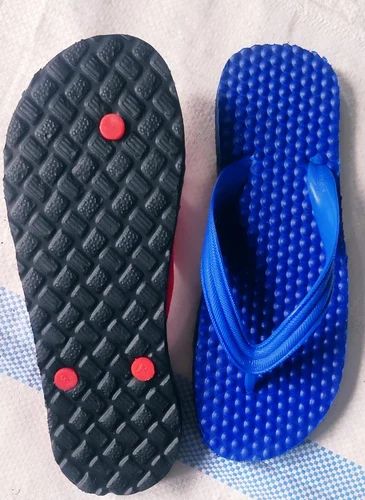
Image resolution: width=365 pixels, height=500 pixels. In order to click on floor in this screenshot , I will do `click(349, 452)`.